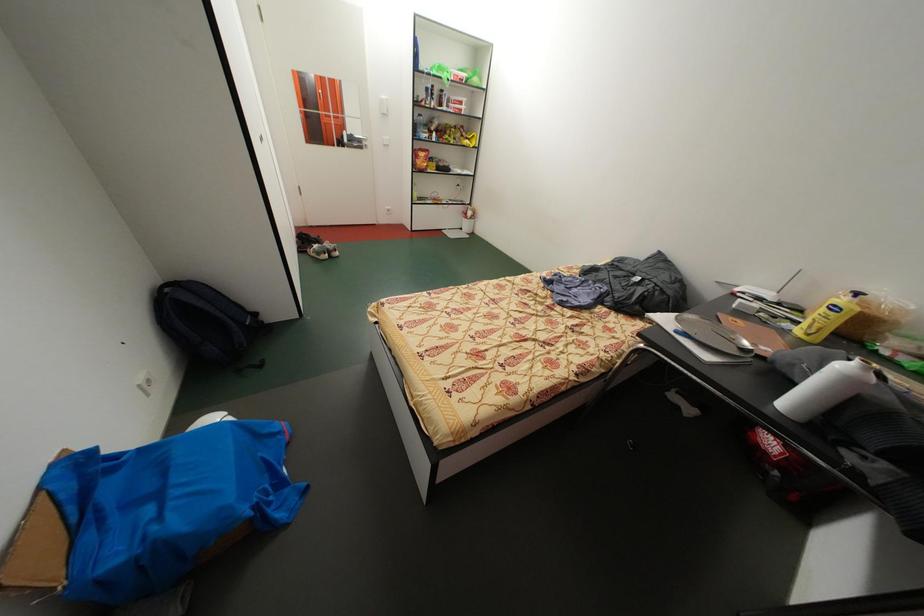
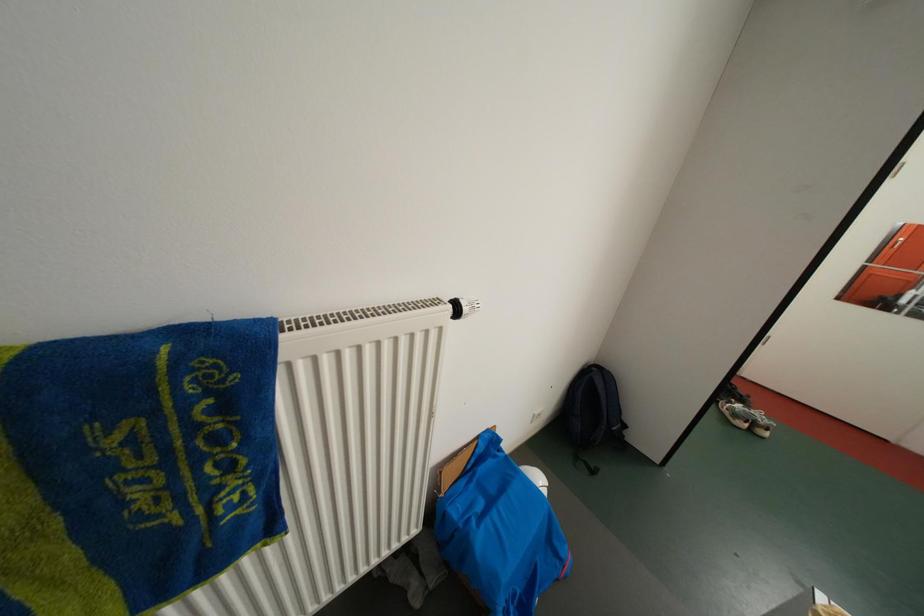
Question: Based on the continuous images, in which direction is the camera rotating? Reply with the corresponding letter.

Choices:
 (A) Left
 (B) Right
 (C) Up
 (D) Down

Answer: (A)